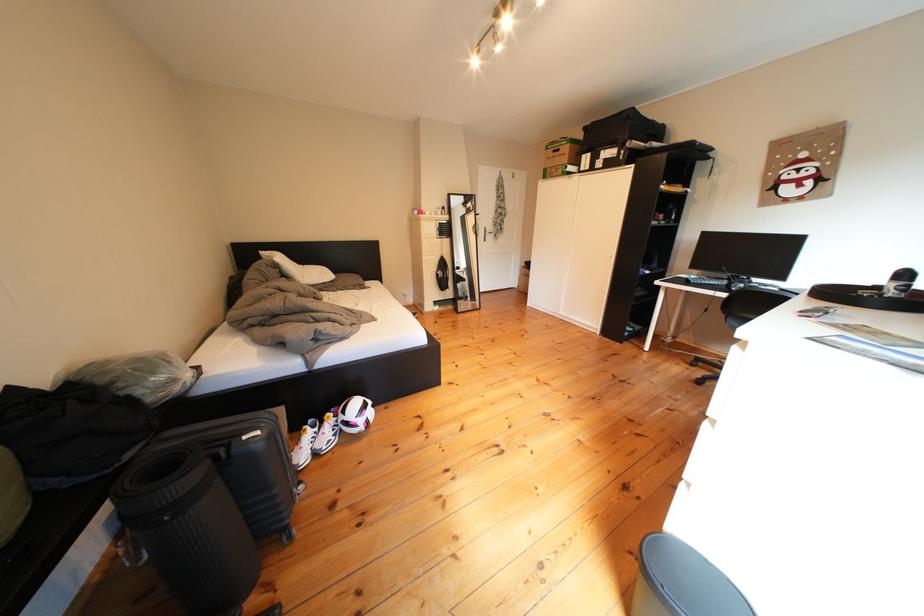
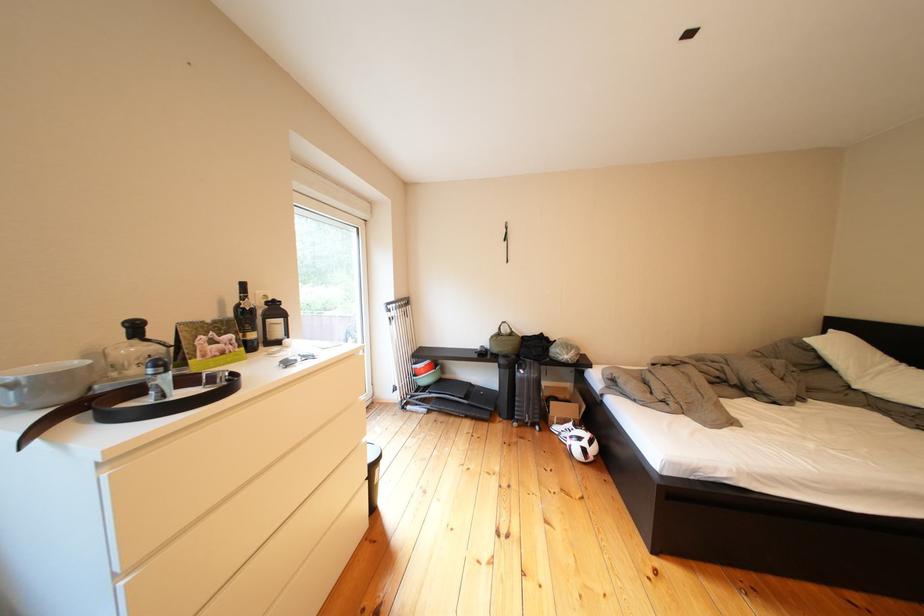
The point at (317, 463) is marked in the first image. Where is the corresponding point in the second image?

(570, 432)